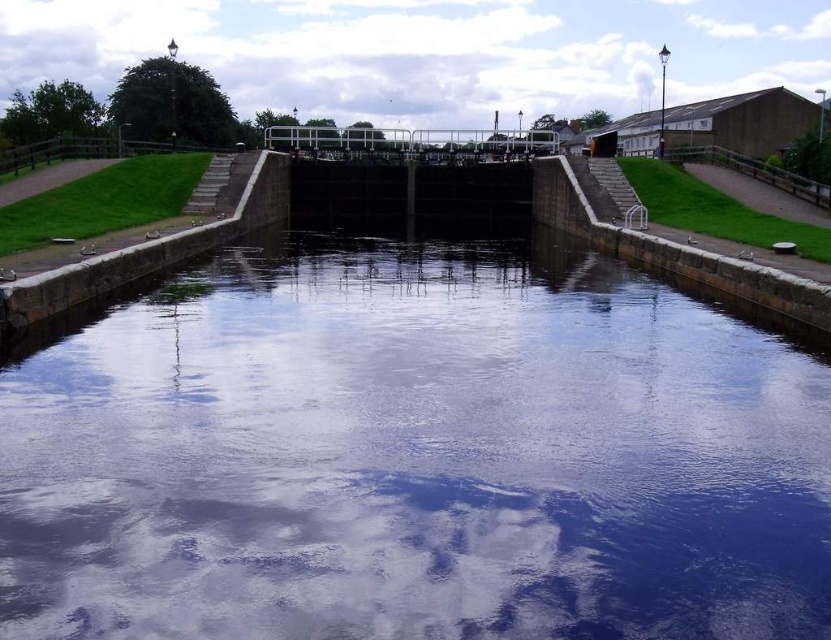
You are standing on the pathway next to the canal lock and notice the transparent water at center and the white fluffy cloud at upper center. Which of these two objects appears larger in the scene?

The white fluffy cloud at upper center appears larger because it is bigger than the transparent water at center.

You are standing at the edge of the canal lock and looking towards the transparent water at center and the white fluffy cloud at upper center. Which object is nearer to you?

The transparent water at center is closer to the viewer than the white fluffy cloud at upper center.

You are standing on the pathway next to the canal lock and see the transparent water at center and the white fluffy cloud at upper center. Which object is closer to the sky?

The white fluffy cloud at upper center is closer to the sky because it is positioned above the transparent water at center.